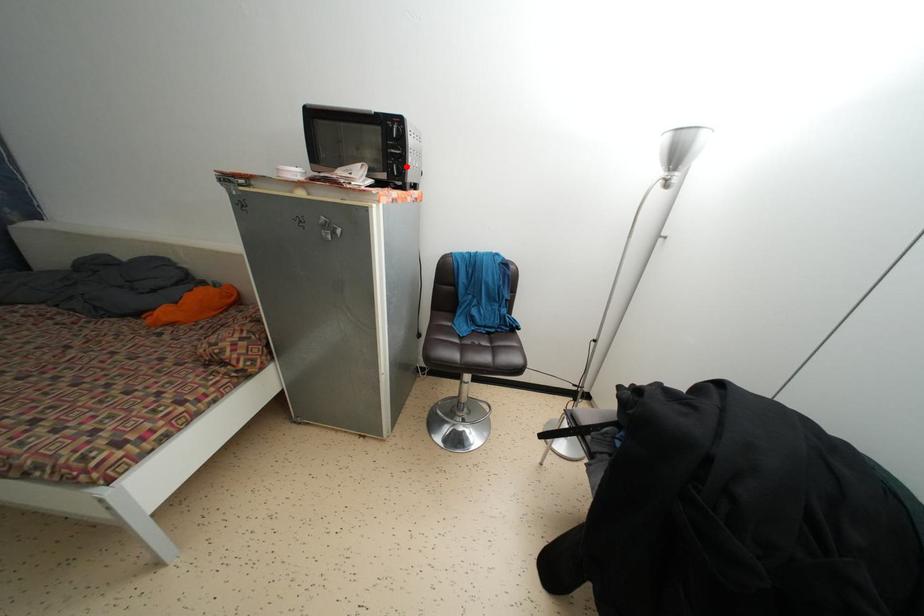
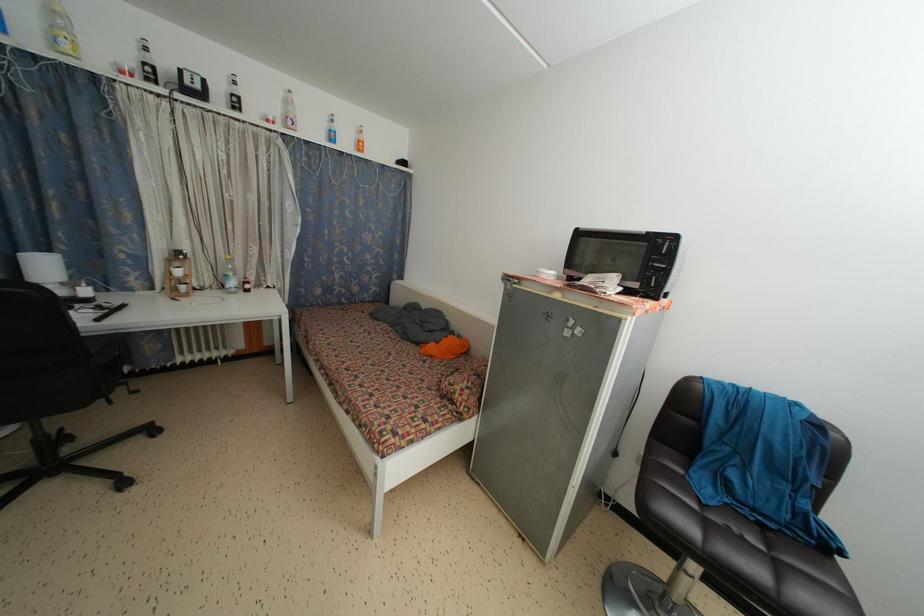
The point at the highlighted location is marked in the first image. Where is the corresponding point in the second image?

(669, 280)